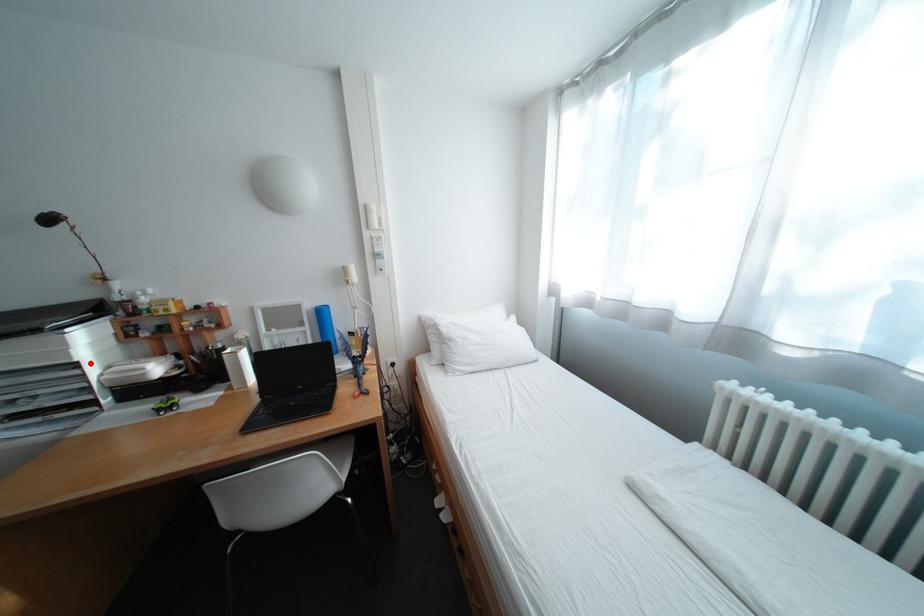
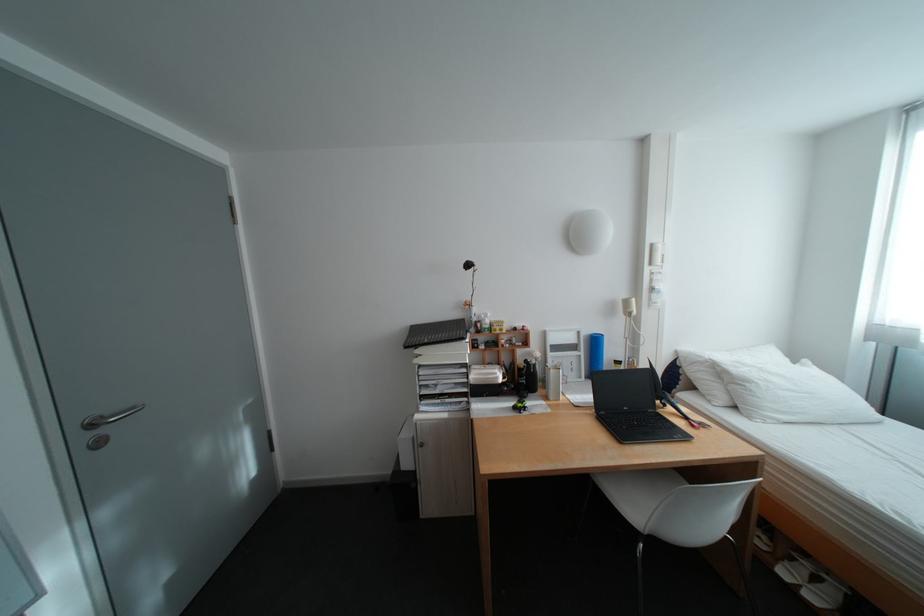
The point at the highlighted location is marked in the first image. Where is the corresponding point in the second image?

(480, 363)